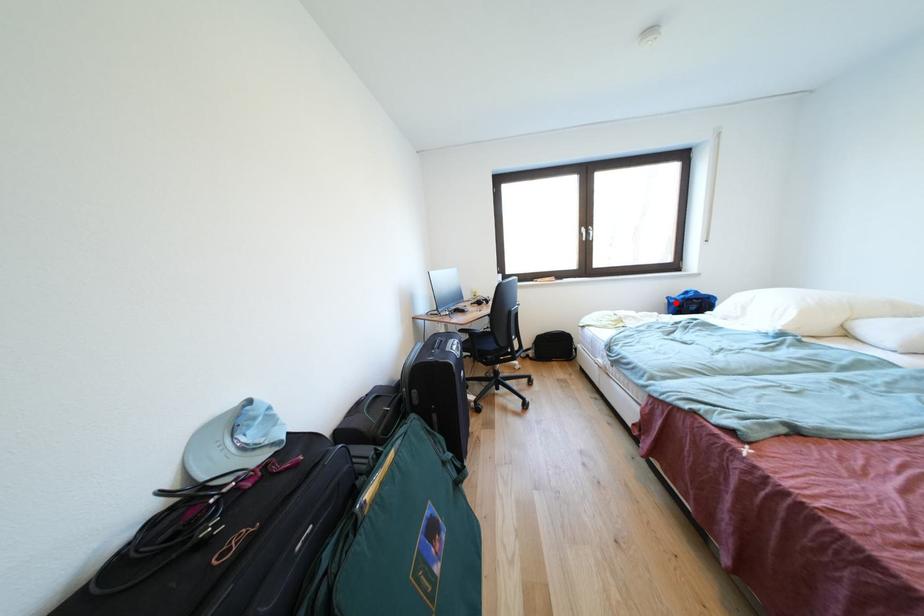
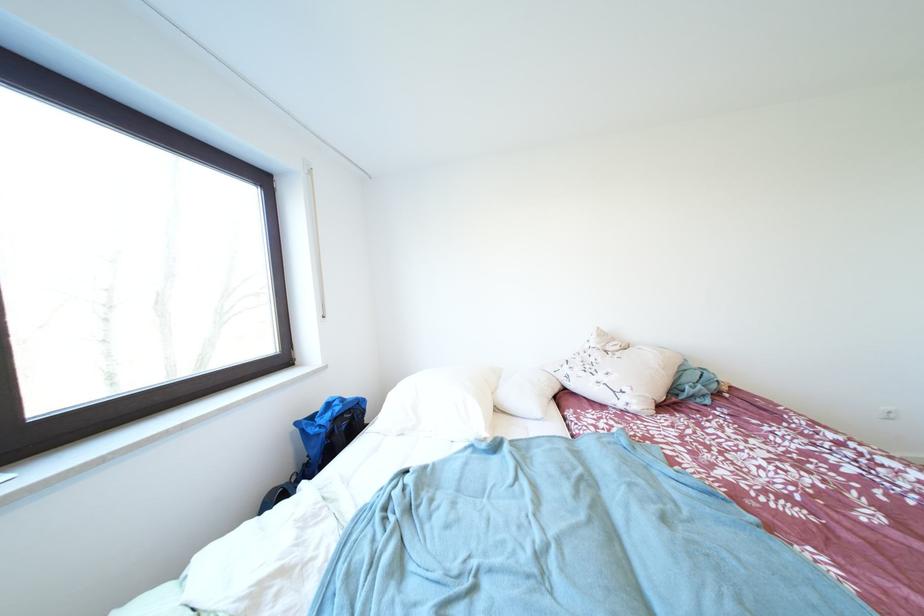
In the second image, find the point that corresponds to the highlighted location in the first image.

(305, 428)